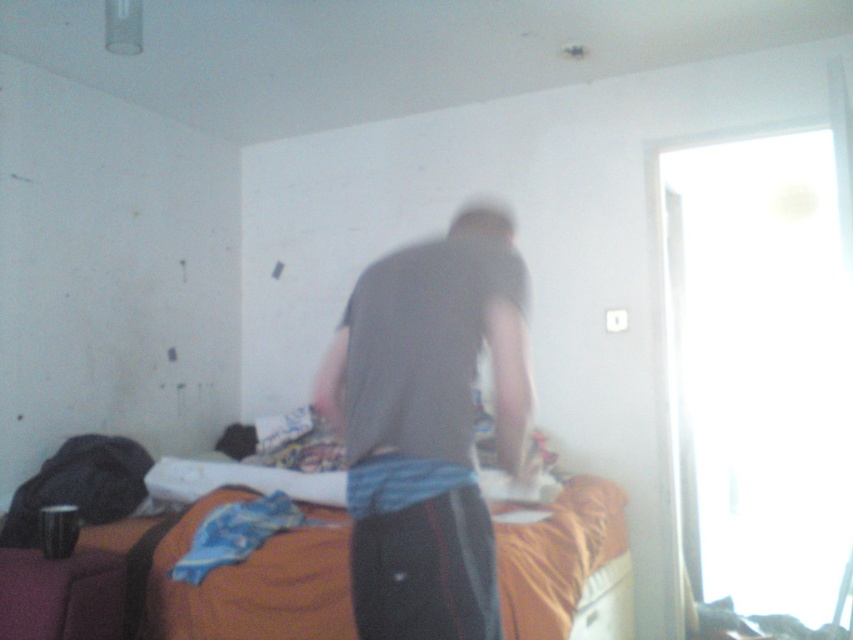
Which is behind, point (451, 292) or point (339, 637)?

Point (339, 637)

Does dark gray shirt at center come behind orange fabric bed at center?

No, it is in front of orange fabric bed at center.

Who is more distant from viewer, (x=386, y=506) or (x=305, y=536)?

The point (x=305, y=536) is more distant.

The width and height of the screenshot is (853, 640). I want to click on dark gray shirt at center, so pos(428,426).